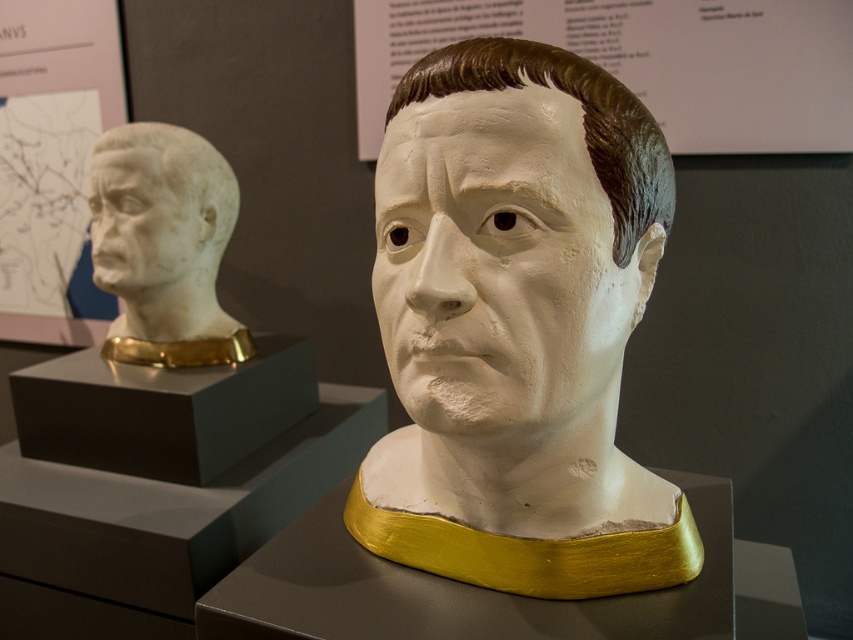
Question: Is white matte bust at center to the left of white matte plaster head at center from the viewer's perspective?

Choices:
 (A) yes
 (B) no

Answer: (A)

Question: Can you confirm if white matte plaster head at center is smaller than white plaster face at upper left?

Choices:
 (A) yes
 (B) no

Answer: (B)

Question: Which point appears closest to the camera in this image?

Choices:
 (A) (440, 524)
 (B) (466, 179)

Answer: (B)

Question: Which of the following is the closest to the observer?

Choices:
 (A) white matte bust at center
 (B) white matte plaster head at center
 (C) white plaster face at upper left
 (D) white marble bust at left

Answer: (A)

Question: Among these objects, which one is nearest to the camera?

Choices:
 (A) white matte bust at center
 (B) white matte plaster head at center

Answer: (A)

Question: Does white matte bust at center appear on the left side of white plaster face at upper left?

Choices:
 (A) yes
 (B) no

Answer: (B)